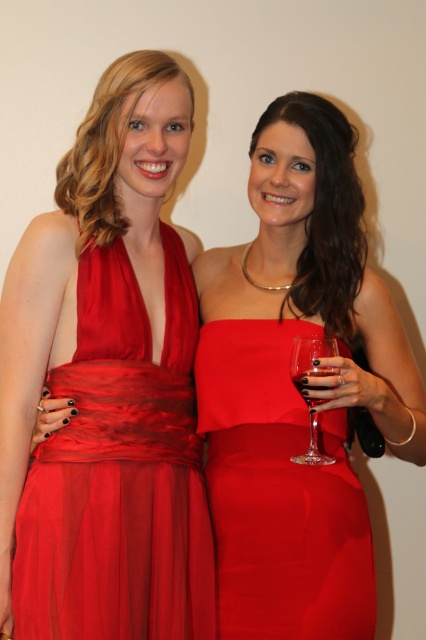
Can you confirm if shiny satin dress at left is bigger than transparent glass at right?

Yes, shiny satin dress at left is bigger than transparent glass at right.

Does shiny satin dress at left appear on the right side of transparent glass at right?

No, shiny satin dress at left is not to the right of transparent glass at right.

Who is more distant from viewer, (138,637) or (321,388)?

The point (138,637) is behind.

At what (x,y) coordinates should I click in order to perform the action: click on shiny satin dress at left. Please return your answer as a coordinate pair (x, y). The height and width of the screenshot is (640, 426). Looking at the image, I should click on (120, 472).

Between transparent glass at center and transparent glass at right, which one is positioned higher?

transparent glass at right is above.

Locate an element on the screen. transparent glass at center is located at coordinates (304, 387).

Where is `transparent glass at center`? The image size is (426, 640). transparent glass at center is located at coordinates 304,387.

Is shiny satin dress at left bigger than transparent glass at center?

Indeed, shiny satin dress at left has a larger size compared to transparent glass at center.

From the picture: Is shiny satin dress at left taller than transparent glass at center?

Yes, shiny satin dress at left is taller than transparent glass at center.

Is point (92, 404) positioned in front of point (333, 342)?

No.

Locate an element on the screen. This screenshot has width=426, height=640. shiny satin dress at left is located at coordinates (120, 472).